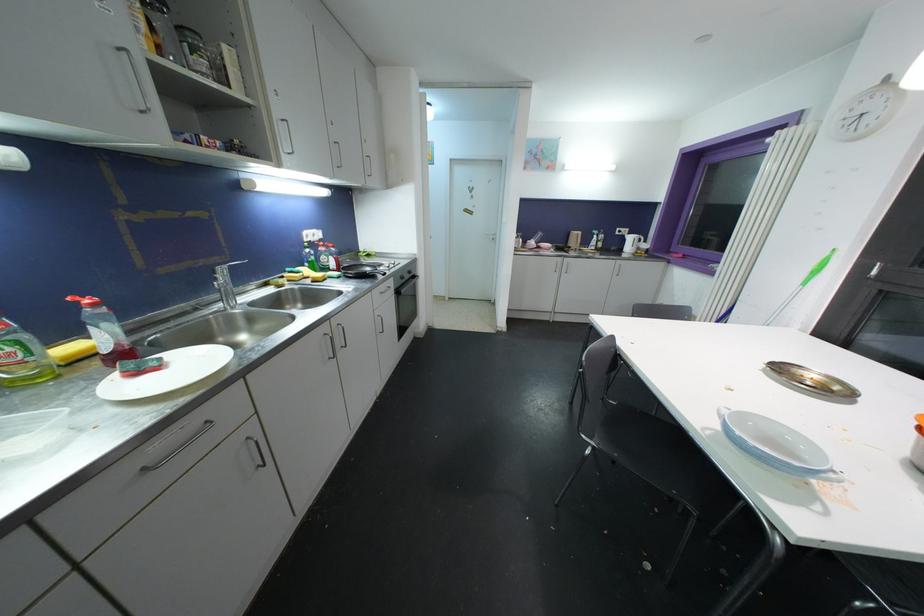
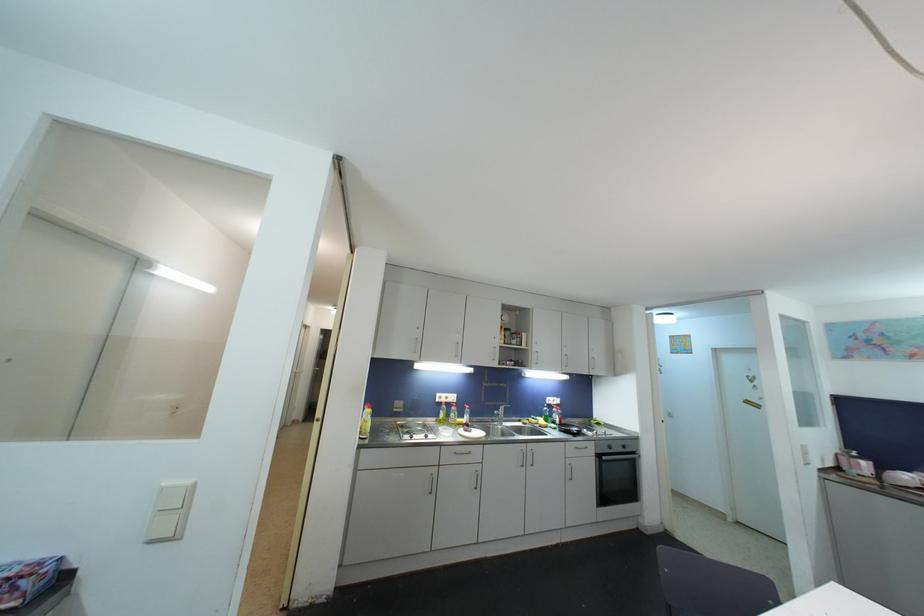
Find the pixel in the second image that matches (405,334) in the first image.

(608, 501)